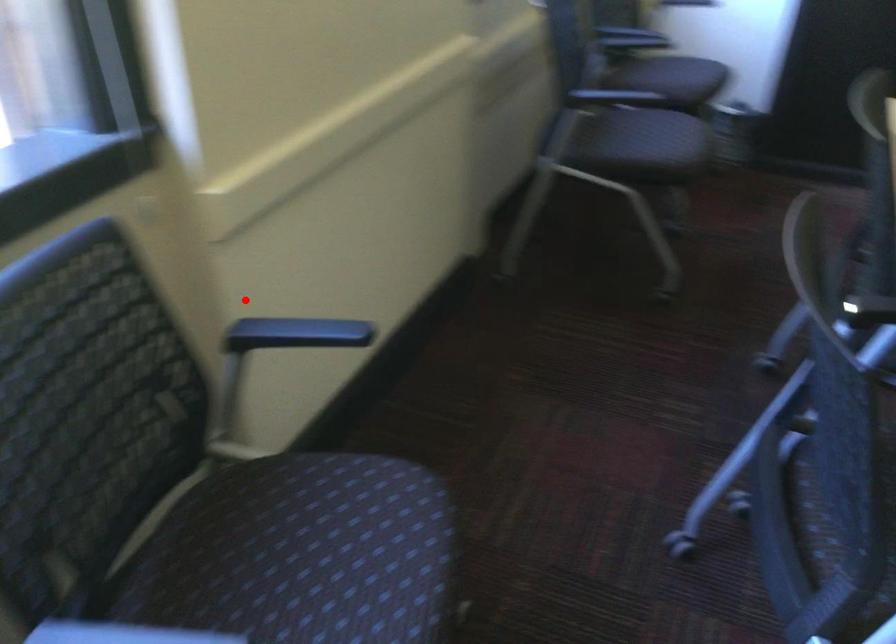
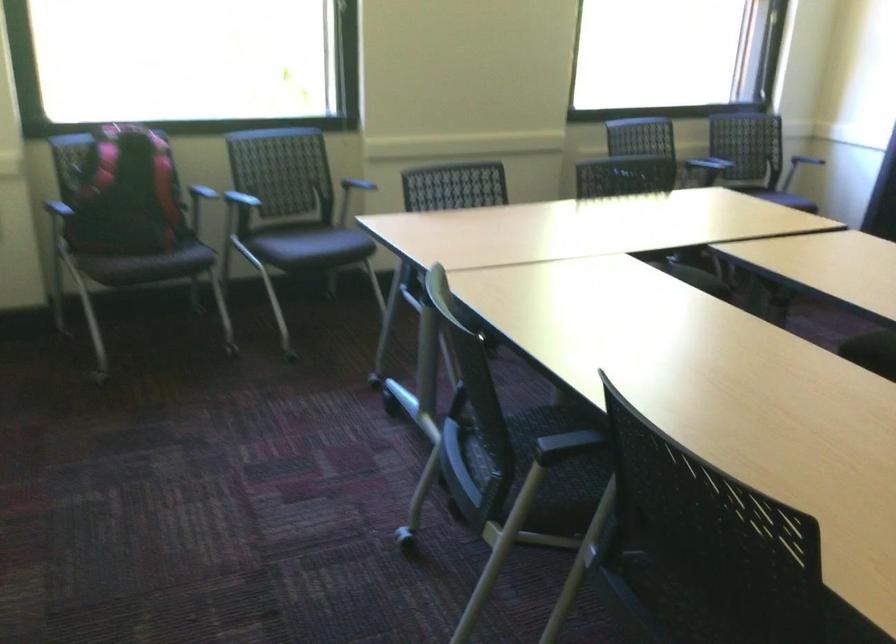
Question: I am providing you with two images of the same scene from different viewpoints. A red point is marked on the first image. At the location where the point appears in image 1, is it still visible in image 2?

Choices:
 (A) Yes
 (B) No

Answer: (A)